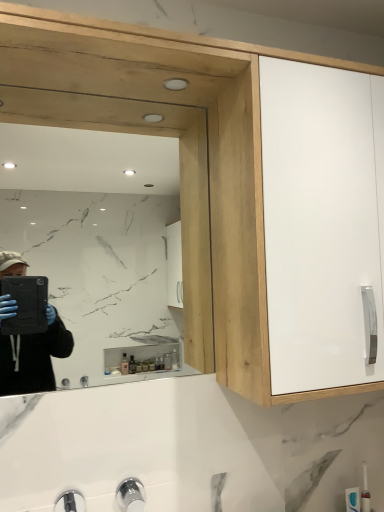
Question: Is clear glass mirror at upper left taller or shorter than white glossy cabinet door at upper right?

Choices:
 (A) short
 (B) tall

Answer: (A)

Question: From the image's perspective, is clear glass mirror at upper left located above or below white glossy cabinet door at upper right?

Choices:
 (A) below
 (B) above

Answer: (A)

Question: Considering the positions of clear glass mirror at upper left and white glossy cabinet door at upper right in the image, is clear glass mirror at upper left bigger or smaller than white glossy cabinet door at upper right?

Choices:
 (A) small
 (B) big

Answer: (A)

Question: From the image's perspective, relative to clear glass mirror at upper left, is white glossy cabinet door at upper right above or below?

Choices:
 (A) below
 (B) above

Answer: (B)

Question: From a real-world perspective, relative to clear glass mirror at upper left, is white glossy cabinet door at upper right vertically above or below?

Choices:
 (A) below
 (B) above

Answer: (B)

Question: Is white glossy cabinet door at upper right situated inside clear glass mirror at upper left or outside?

Choices:
 (A) outside
 (B) inside

Answer: (A)

Question: Considering the positions of white glossy cabinet door at upper right and clear glass mirror at upper left in the image, is white glossy cabinet door at upper right taller or shorter than clear glass mirror at upper left?

Choices:
 (A) short
 (B) tall

Answer: (B)